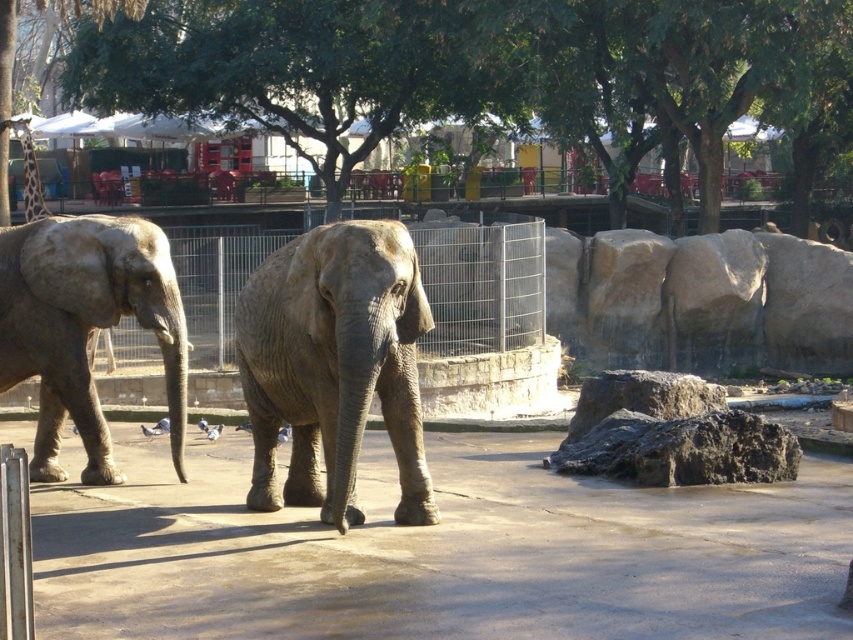
You are a zookeeper observing the elephants. You notice the gray matte elephant at center and the metal wire fence at center. From your vantage point, which object is positioned to the left?

The metal wire fence at center is positioned to the left of the gray matte elephant at center.

You are standing at the entrance of the zoo enclosure and see two points marked on the ground. The first point is at coordinate point (x=376, y=392) and the second is at point (x=495, y=244). Which point is closer to you?

Point (x=376, y=392) is closer to the camera than point (x=495, y=244), so the first point is closer to you.